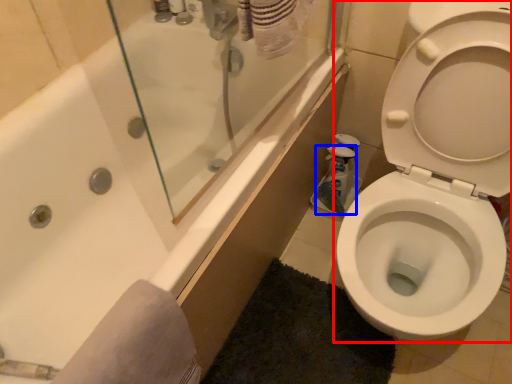
Question: Which point is further to the camera, toilet (highlighted by a red box) or cleaning product (highlighted by a blue box)?

Choices:
 (A) toilet
 (B) cleaning product

Answer: (B)